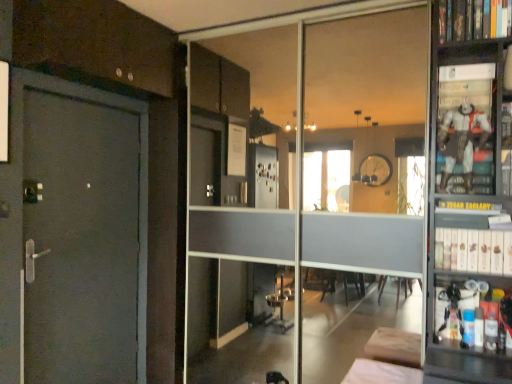
At what (x,y) coordinates should I click in order to perform the action: click on free point above metallic figure at right (from a real-world perspective). Please return your answer as a coordinate pair (x, y). The image size is (512, 384). Looking at the image, I should click on (468, 64).